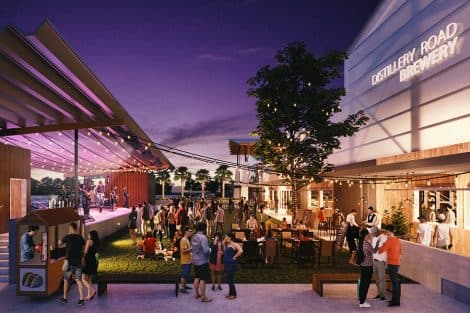
At what (x,y) coordinates should I click in order to perform the action: click on bench. Please return your answer as a coordinate pair (x, y). Looking at the image, I should click on (324, 277).